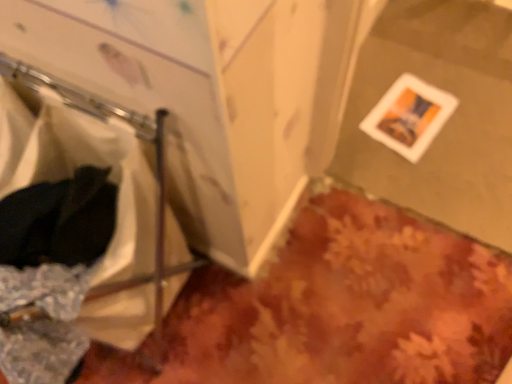
Question: Is white matte picture frame at lower right facing towards white fabric laundry at left?

Choices:
 (A) yes
 (B) no

Answer: (B)

Question: Is white matte picture frame at lower right shorter than white fabric laundry at left?

Choices:
 (A) no
 (B) yes

Answer: (B)

Question: From the image's perspective, would you say white matte picture frame at lower right is shown under white fabric laundry at left?

Choices:
 (A) no
 (B) yes

Answer: (A)

Question: Is white matte picture frame at lower right behind white fabric laundry at left?

Choices:
 (A) no
 (B) yes

Answer: (B)

Question: Is white matte picture frame at lower right taller than white fabric laundry at left?

Choices:
 (A) yes
 (B) no

Answer: (B)

Question: Is white matte picture frame at lower right outside white fabric laundry at left?

Choices:
 (A) no
 (B) yes

Answer: (B)

Question: Could you tell me if white fabric laundry at left is turned towards white matte picture frame at lower right?

Choices:
 (A) yes
 (B) no

Answer: (B)

Question: Is white fabric laundry at left far away from white matte picture frame at lower right?

Choices:
 (A) no
 (B) yes

Answer: (B)

Question: Is white fabric laundry at left turned away from white matte picture frame at lower right?

Choices:
 (A) yes
 (B) no

Answer: (A)

Question: Does white fabric laundry at left appear on the left side of white matte picture frame at lower right?

Choices:
 (A) yes
 (B) no

Answer: (A)

Question: Considering the relative sizes of white fabric laundry at left and white matte picture frame at lower right in the image provided, is white fabric laundry at left wider than white matte picture frame at lower right?

Choices:
 (A) no
 (B) yes

Answer: (B)

Question: Are white fabric laundry at left and white matte picture frame at lower right beside each other?

Choices:
 (A) yes
 (B) no

Answer: (B)

Question: From a real-world perspective, is white matte picture frame at lower right physically located above or below white fabric laundry at left?

Choices:
 (A) below
 (B) above

Answer: (A)